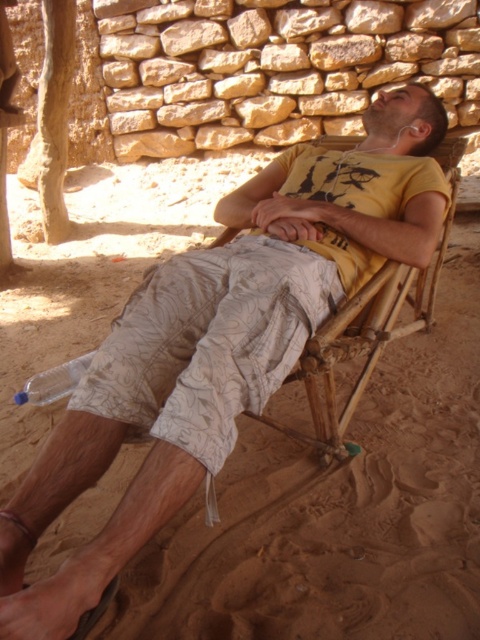
Question: Which point is closer to the camera taking this photo?

Choices:
 (A) (180, 340)
 (B) (361, 304)

Answer: (A)

Question: From the image, what is the correct spatial relationship of white textured shorts at center in relation to bamboo beach chair at center?

Choices:
 (A) below
 (B) above

Answer: (A)

Question: Does white textured shorts at center have a larger size compared to bamboo beach chair at center?

Choices:
 (A) yes
 (B) no

Answer: (B)

Question: Can you confirm if white textured shorts at center is smaller than bamboo beach chair at center?

Choices:
 (A) no
 (B) yes

Answer: (B)